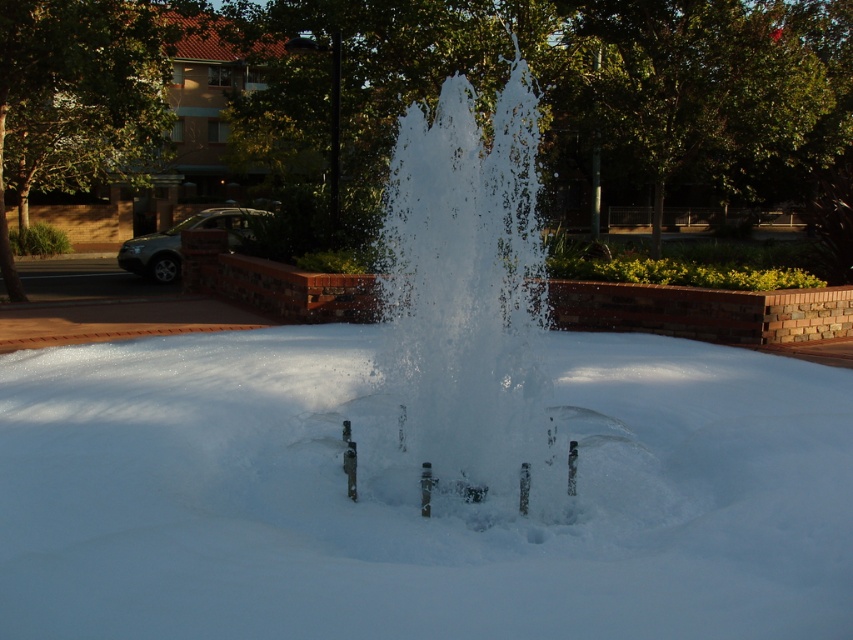
Question: Which point is farther to the camera?

Choices:
 (A) (599, 586)
 (B) (491, 216)

Answer: (B)

Question: Does white frosty snow at center appear over clear water fountain at center?

Choices:
 (A) yes
 (B) no

Answer: (B)

Question: Is white frosty snow at center closer to the viewer compared to clear water fountain at center?

Choices:
 (A) no
 (B) yes

Answer: (B)

Question: Considering the relative positions of white frosty snow at center and clear water fountain at center in the image provided, where is white frosty snow at center located with respect to clear water fountain at center?

Choices:
 (A) right
 (B) left

Answer: (B)

Question: Among these points, which one is farthest from the camera?

Choices:
 (A) (491, 154)
 (B) (26, 440)

Answer: (B)

Question: Which point is farther from the camera taking this photo?

Choices:
 (A) (318, 384)
 (B) (532, 99)

Answer: (A)